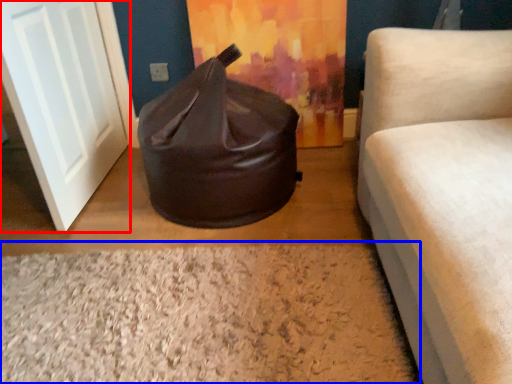
Question: Which object appears farthest to the camera in this image, door (highlighted by a red box) or granite (highlighted by a blue box)?

Choices:
 (A) door
 (B) granite

Answer: (A)